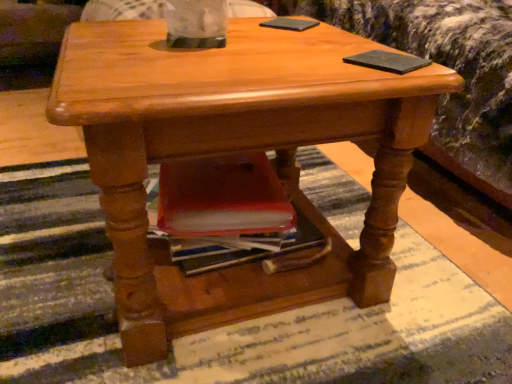
Question: Is point (306, 28) closer or farther from the camera than point (390, 64)?

Choices:
 (A) closer
 (B) farther

Answer: (B)

Question: From the image's perspective, is green matte pad at upper center, acting as the second pad starting from the bottom, positioned above or below black matte pad at upper right, positioned as the second pad in top-to-bottom order?

Choices:
 (A) below
 (B) above

Answer: (B)

Question: Relative to black matte pad at upper right, positioned as the second pad in top-to-bottom order, is green matte pad at upper center, which ranks as the 1th pad in top-to-bottom order, in front or behind?

Choices:
 (A) front
 (B) behind

Answer: (B)

Question: Considering the relative positions of black matte pad at upper right, positioned as the second pad in back-to-front order, and green matte pad at upper center, which ranks as the 1th pad in top-to-bottom order, in the image provided, is black matte pad at upper right, positioned as the second pad in back-to-front order, to the left or to the right of green matte pad at upper center, which ranks as the 1th pad in top-to-bottom order,?

Choices:
 (A) right
 (B) left

Answer: (A)

Question: From the image's perspective, is black matte pad at upper right, positioned as the second pad in top-to-bottom order, above or below green matte pad at upper center, the 2th pad from the front?

Choices:
 (A) above
 (B) below

Answer: (B)

Question: Is black matte pad at upper right, positioned as the second pad in back-to-front order, taller or shorter than green matte pad at upper center, which is the first pad from left to right?

Choices:
 (A) short
 (B) tall

Answer: (A)

Question: Do you think black matte pad at upper right, which is the first pad from bottom to top, is within green matte pad at upper center, the 2th pad from the front, or outside of it?

Choices:
 (A) inside
 (B) outside

Answer: (B)